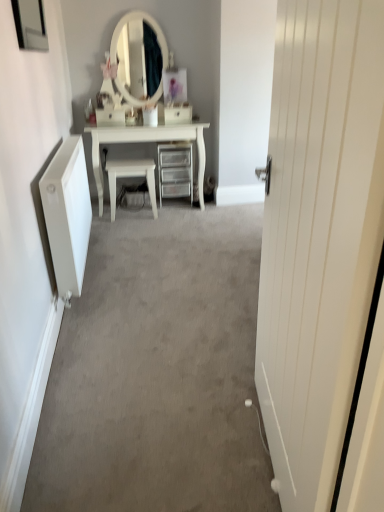
Question: Is white wooden door at right aimed at metallic mirror at upper left?

Choices:
 (A) no
 (B) yes

Answer: (A)

Question: Can you confirm if white wooden door at right is taller than metallic mirror at upper left?

Choices:
 (A) yes
 (B) no

Answer: (A)

Question: Does white wooden door at right have a lesser height compared to metallic mirror at upper left?

Choices:
 (A) no
 (B) yes

Answer: (A)

Question: Are white wooden door at right and metallic mirror at upper left located far from each other?

Choices:
 (A) yes
 (B) no

Answer: (A)

Question: Is white wooden door at right turned away from metallic mirror at upper left?

Choices:
 (A) yes
 (B) no

Answer: (B)

Question: Can you confirm if white wooden door at right is positioned to the right of metallic mirror at upper left?

Choices:
 (A) yes
 (B) no

Answer: (A)

Question: Would you say white glossy chair at center is a long distance from white plastic drawer at center, which appears as the 1th drawer when viewed from the right?

Choices:
 (A) yes
 (B) no

Answer: (B)

Question: From the image's perspective, is white glossy chair at center below white plastic drawer at center, acting as the second drawer starting from the left?

Choices:
 (A) yes
 (B) no

Answer: (A)

Question: From a real-world perspective, is white glossy chair at center located beneath white plastic drawer at center, acting as the second drawer starting from the left?

Choices:
 (A) yes
 (B) no

Answer: (A)

Question: Is white glossy chair at center thinner than white plastic drawer at center, which appears as the 1th drawer when viewed from the right?

Choices:
 (A) yes
 (B) no

Answer: (B)

Question: Can you confirm if white glossy chair at center is bigger than white plastic drawer at center, which appears as the 1th drawer when viewed from the right?

Choices:
 (A) yes
 (B) no

Answer: (A)

Question: From a real-world perspective, does white glossy chair at center stand above white plastic drawer at center, acting as the second drawer starting from the left?

Choices:
 (A) yes
 (B) no

Answer: (B)

Question: Does white glossy chair at center have a greater width compared to white wooden door at right?

Choices:
 (A) yes
 (B) no

Answer: (A)